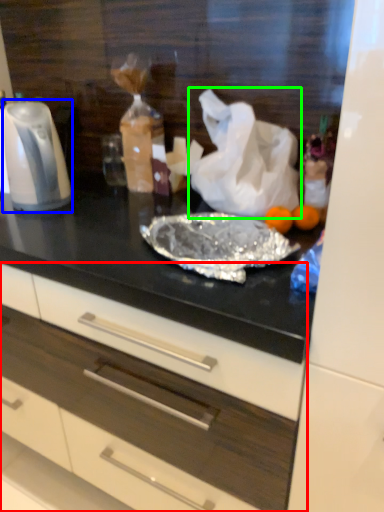
Question: Considering the real-world distances, which object is closest to drawer (highlighted by a red box)? kitchen appliance (highlighted by a blue box) or plastic bag (highlighted by a green box).

Choices:
 (A) kitchen appliance
 (B) plastic bag

Answer: (A)